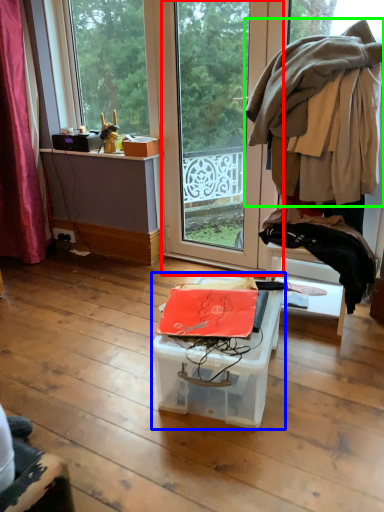
Question: Estimate the real-world distances between objects in this image. Which object is farther from screen door (highlighted by a red box), box (highlighted by a blue box) or clothing (highlighted by a green box)?

Choices:
 (A) box
 (B) clothing

Answer: (A)